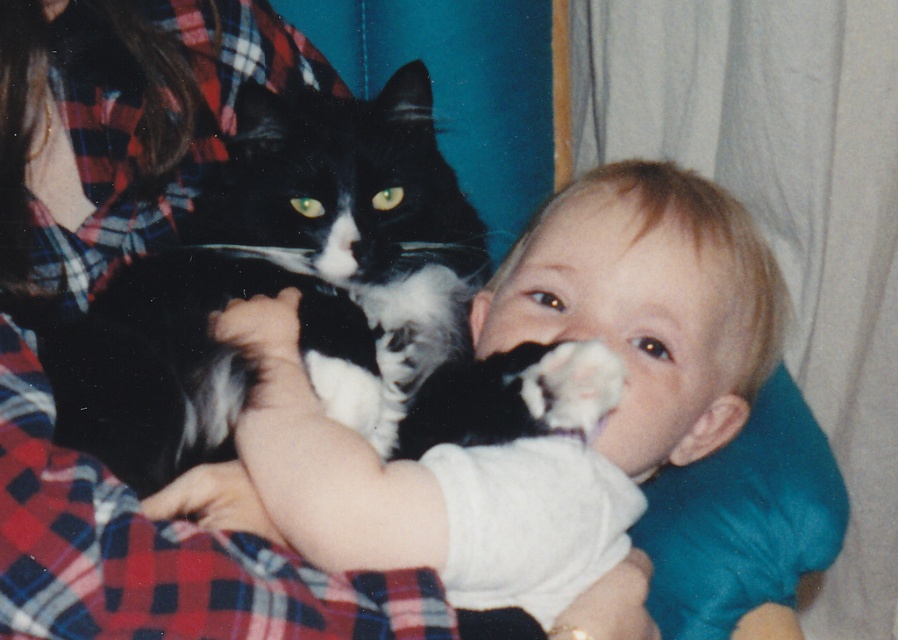
Does black and white fur cat at center have a greater width compared to white soft baby at center?

Incorrect, black and white fur cat at center's width does not surpass white soft baby at center's.

Who is shorter, black and white fur cat at center or white soft baby at center?

With less height is black and white fur cat at center.

Does point (183, 424) lie behind point (324, 550)?

Yes, it is.

Where is `black and white fur cat at center`? The width and height of the screenshot is (898, 640). black and white fur cat at center is located at coordinates (280, 284).